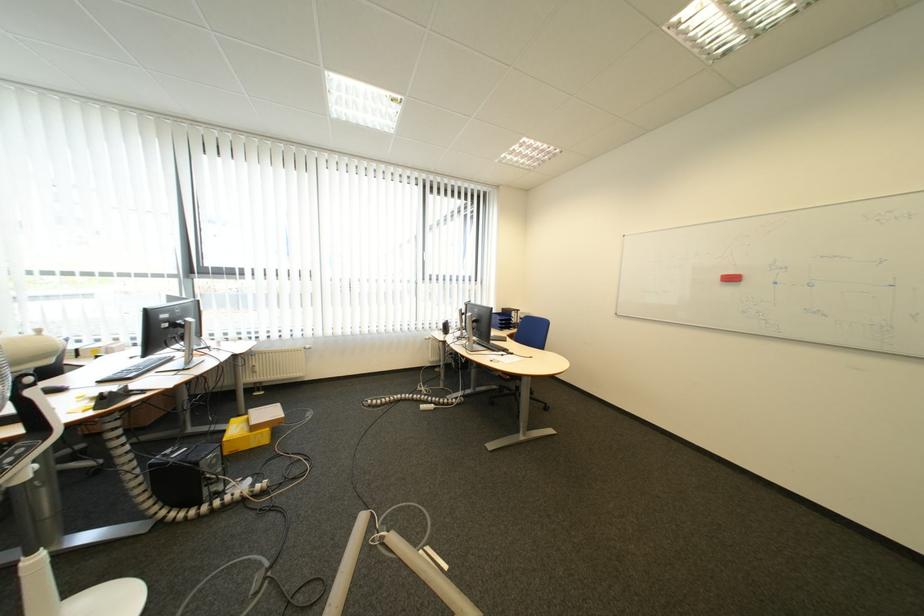
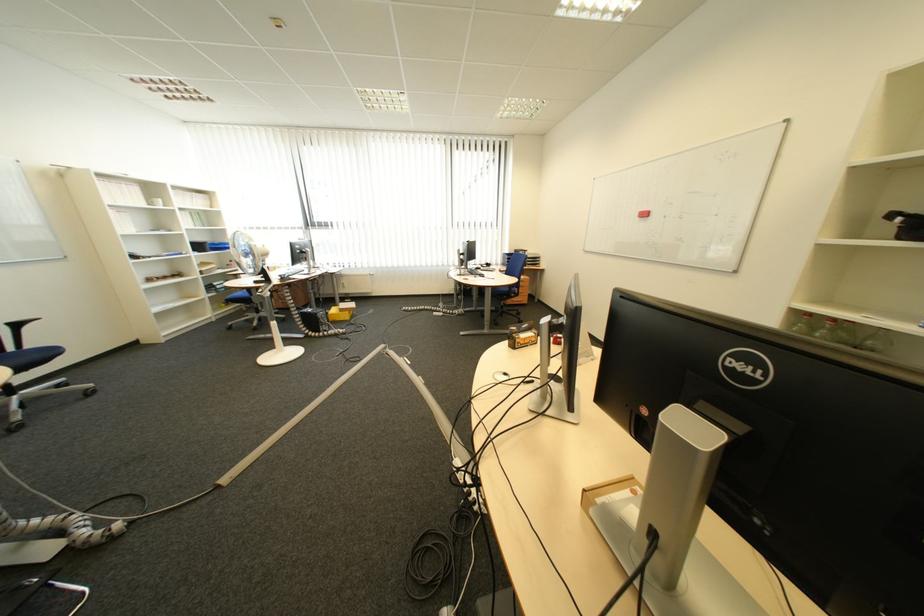
Where in the second image is the point corresponding to (226,463) from the first image?

(335, 317)